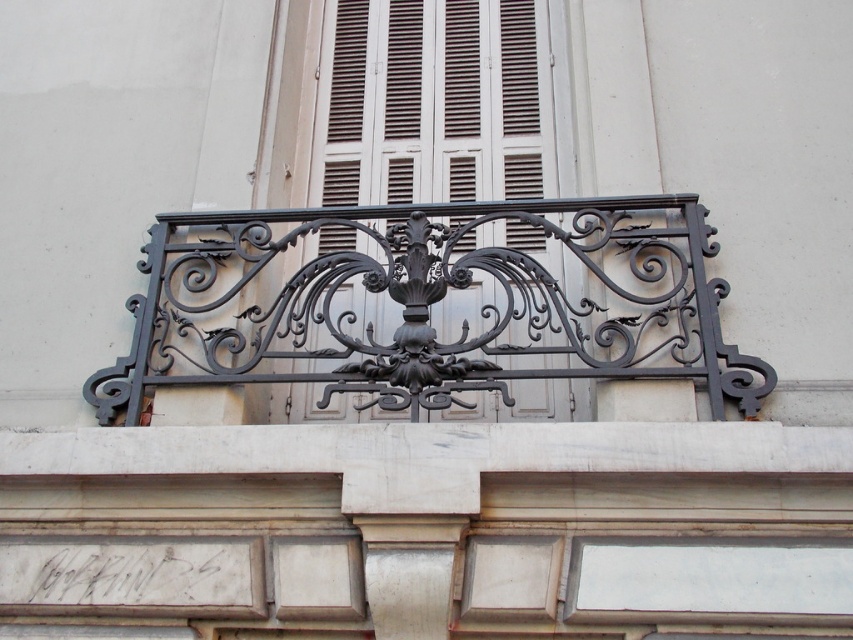
You are an architect assessing the building facade. You need to determine if the black wrought iron balustrade at center can be seen above the brown matte shutter at center. Based on their heights, what is your conclusion?

The black wrought iron balustrade at center is shorter than the brown matte shutter at center, so it cannot be seen above the shutter.

You are standing in front of a building with a decorative wrought iron balcony railing. You notice a point marked at coordinates point (552, 204). If you want to reach this point with a 20 meter long ladder, will the ladder be long enough?

The point (552, 204) is 17.95 meters away from the viewer, so a 20 meter long ladder will be long enough to reach it.

You are an architect designing a new building and want to ensure that the black wrought iron balustrade at center and the brown matte shutter at center are proportionate. Given that the balustrade is wider than the shutter, how should you adjust their placement to maintain visual harmony?

Since the black wrought iron balustrade at center is wider than the brown matte shutter at center, you should position the balustrade closer to the center of the facade and place the shutter slightly off to one side to balance their visual weight.